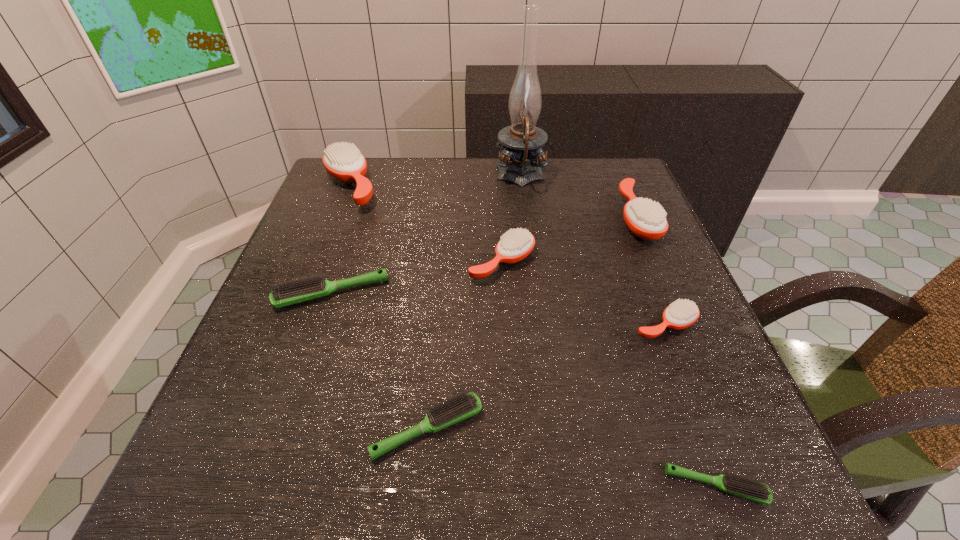
In order to click on vacant space located on the back of the second nearest light hairbrush in this screenshot , I will do `click(444, 252)`.

Locate an element on the screen. This screenshot has height=540, width=960. vacant region located 0.100m on the left of the smallest light hairbrush is located at coordinates (596, 485).

Find the location of a particular element. The image size is (960, 540). oil lamp that is at the far edge is located at coordinates (521, 144).

Where is `object positioned at the far left corner`? This screenshot has width=960, height=540. object positioned at the far left corner is located at coordinates (344, 162).

In order to click on object that is at the far right corner in this screenshot , I will do pyautogui.click(x=646, y=219).

You are a GUI agent. You are given a task and a screenshot of the screen. Output one action in this format:
    pyautogui.click(x=<x>, y=<y>)
    Task: Click on the object that is at the near right corner
    This screenshot has width=960, height=540.
    Given the screenshot: What is the action you would take?
    pyautogui.click(x=749, y=488)

At what (x,y) coordinates should I click in order to perform the action: click on vacant space at the far edge of the desktop. Please return your answer as a coordinate pair (x, y). This screenshot has width=960, height=540. Looking at the image, I should click on (573, 174).

This screenshot has width=960, height=540. Find the location of `vacant space at the left edge of the desktop`. vacant space at the left edge of the desktop is located at coordinates (237, 379).

This screenshot has height=540, width=960. Find the location of `vacant point at the right edge`. vacant point at the right edge is located at coordinates (698, 306).

This screenshot has height=540, width=960. In order to click on vacant space at the near left corner of the desktop in this screenshot , I will do `click(247, 484)`.